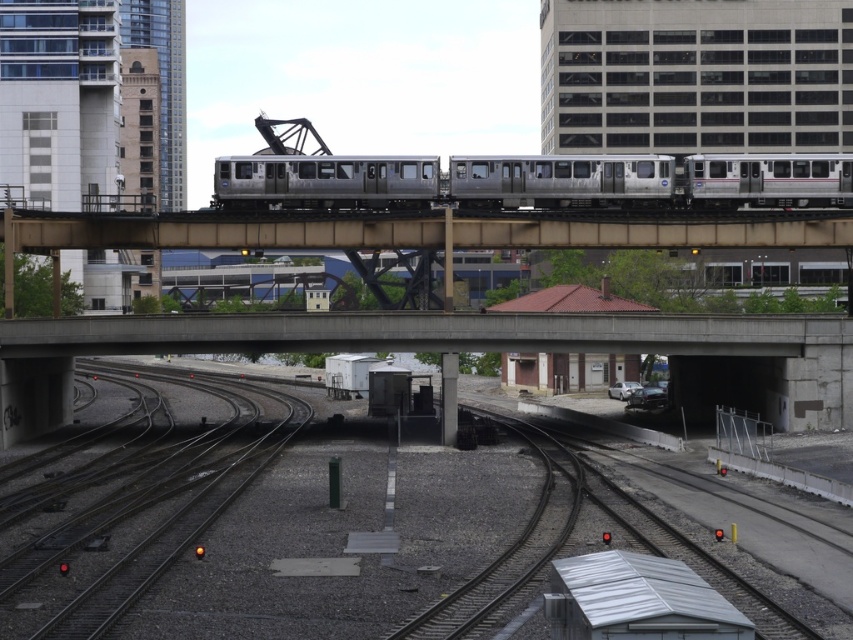
You are a railway engineer inspecting the tracks. You need to locate the smooth concrete tracks at center for maintenance. According to the coordinates provided, where exactly should you look on the image?

The smooth concrete tracks at center are located at point coordinates of (355, 518).

You are a pedestrian standing on the concrete bridge at center. You see the silver metallic train at center approaching from the left. In which direction should you move to stay safe?

The concrete bridge at center is positioned under the silver metallic train at center, so the train is passing over the bridge. To stay safe, you should move to the side of the concrete bridge at center away from the tracks and find a designated platform or area clear of the train path.

You are an engineer inspecting the railway tracks. You notice two points marked on your map at coordinates point (30, 381) and point (163, 493). According to the image, which point is closer to the train traveling from left to right?

Point (163, 493) is closer to the train traveling from left to right because point (30, 381) is behind it.